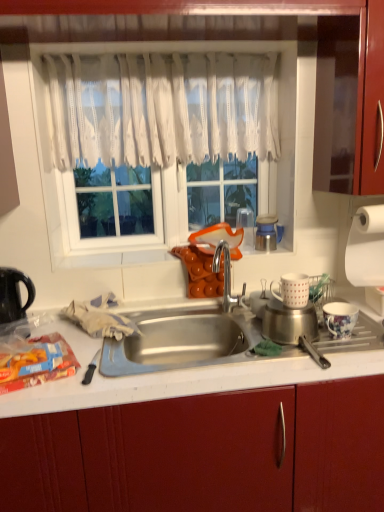
Image resolution: width=384 pixels, height=512 pixels. What are the coordinates of `free space above white lace curtain at upper center (from a real-world perspective)` in the screenshot? It's located at (152, 53).